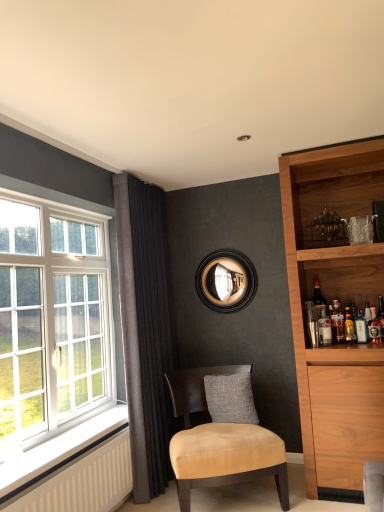
Identify the location of blank space above white textured radiator at lower left (from a real-world perspective). tap(79, 444).